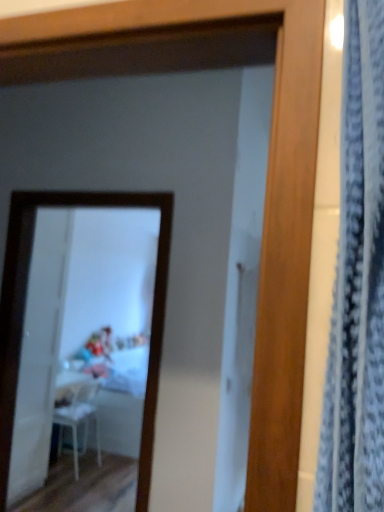
What are the coordinates of `transparent plastic screen door at left` in the screenshot? It's located at (40, 351).

Locate an element on the screen. The width and height of the screenshot is (384, 512). blue textured curtain at right is located at coordinates (357, 282).

Measure the distance between white glossy mirror at upper center and camera.

A distance of 2.93 meters exists between white glossy mirror at upper center and camera.

In order to face white glossy mirror at upper center, should I rotate leftwards or rightwards?

To face it directly, rotate left by 16.118 degrees.

The height and width of the screenshot is (512, 384). What do you see at coordinates (78, 411) in the screenshot?
I see `white plastic chair at lower left` at bounding box center [78, 411].

Where is `white glossy table at center`? The height and width of the screenshot is (512, 384). white glossy table at center is located at coordinates (125, 383).

You are a GUI agent. You are given a task and a screenshot of the screen. Output one action in this format:
    pyautogui.click(x=<x>, y=<y>)
    Task: Click on the transparent plastic screen door at left
    
    Given the screenshot: What is the action you would take?
    pyautogui.click(x=40, y=351)

Could you tell me if blue textured curtain at right is turned towards white glossy mirror at upper center?

No, blue textured curtain at right is not aimed at white glossy mirror at upper center.

From a real-world perspective, is blue textured curtain at right physically located above or below white glossy mirror at upper center?

In terms of real-world spatial position, blue textured curtain at right is above white glossy mirror at upper center.

How different are the orientations of blue textured curtain at right and white glossy mirror at upper center in degrees?

They differ by 87.1 degrees in their facing directions.

In the scene shown: Is transparent plastic screen door at left to the right of white glossy table at center from the viewer's perspective?

No, transparent plastic screen door at left is not to the right of white glossy table at center.

Does transparent plastic screen door at left lie in front of white glossy table at center?

Yes, it is.

Identify the location of table below the transparent plastic screen door at left (from a real-world perspective). (x=125, y=383).

From a real-world perspective, is transparent plastic screen door at left located beneath white glossy mirror at upper center?

Yes.

Considering the sizes of objects transparent plastic screen door at left and white glossy mirror at upper center in the image provided, who is bigger, transparent plastic screen door at left or white glossy mirror at upper center?

white glossy mirror at upper center.

Is transparent plastic screen door at left wider than white glossy mirror at upper center?

No, transparent plastic screen door at left is not wider than white glossy mirror at upper center.

Is white glossy mirror at upper center smaller than transparent plastic screen door at left?

No.

Which is more to the right, white glossy mirror at upper center or transparent plastic screen door at left?

Positioned to the right is white glossy mirror at upper center.

Which is behind, white glossy mirror at upper center or transparent plastic screen door at left?

transparent plastic screen door at left is further away from the camera.

Do you think white glossy mirror at upper center is within transparent plastic screen door at left, or outside of it?

white glossy mirror at upper center is spatially situated outside transparent plastic screen door at left.

Locate an element on the screen. curtain on the right of white plastic chair at lower left is located at coordinates (357, 282).

From a real-world perspective, is blue textured curtain at right positioned above or below white plastic chair at lower left?

blue textured curtain at right is above white plastic chair at lower left.

Based on their sizes in the image, would you say blue textured curtain at right is bigger or smaller than white plastic chair at lower left?

Considering their sizes, blue textured curtain at right takes up less space than white plastic chair at lower left.

Which is behind, transparent plastic screen door at left or white plastic chair at lower left?

Positioned behind is white plastic chair at lower left.

Is transparent plastic screen door at left not within white plastic chair at lower left?

Indeed, transparent plastic screen door at left is completely outside white plastic chair at lower left.

Between transparent plastic screen door at left and white plastic chair at lower left, which one has more height?

With more height is transparent plastic screen door at left.

Considering the sizes of transparent plastic screen door at left and white plastic chair at lower left in the image, is transparent plastic screen door at left wider or thinner than white plastic chair at lower left?

Clearly, transparent plastic screen door at left has less width compared to white plastic chair at lower left.

Is point (89, 256) farther from viewer compared to point (335, 390)?

That is True.

From a real-world perspective, is white glossy mirror at upper center positioned under blue textured curtain at right based on gravity?

Yes, from a real-world perspective, white glossy mirror at upper center is beneath blue textured curtain at right.

Identify the location of curtain above the white glossy mirror at upper center (from a real-world perspective). Image resolution: width=384 pixels, height=512 pixels. (357, 282).

Which object is closer to the camera, white glossy mirror at upper center or blue textured curtain at right?

blue textured curtain at right is closer to the camera.

Identify the location of mirror that appears below the blue textured curtain at right (from a real-world perspective). The width and height of the screenshot is (384, 512). (85, 347).

Find the location of a particular element. The image size is (384, 512). screen door that appears above the white glossy table at center (from the image's perspective) is located at coordinates [x=40, y=351].

Considering their positions, is white glossy table at center positioned further to white glossy mirror at upper center than blue textured curtain at right?

Among the two, blue textured curtain at right is located further to white glossy mirror at upper center.

Considering their positions, is white glossy table at center positioned further to white plastic chair at lower left than blue textured curtain at right?

Among the two, blue textured curtain at right is located further to white plastic chair at lower left.

Based on their spatial positions, is blue textured curtain at right or transparent plastic screen door at left closer to white plastic chair at lower left?

transparent plastic screen door at left.

Estimate the real-world distances between objects in this image. Which object is further from white plastic chair at lower left, transparent plastic screen door at left or blue textured curtain at right?

Based on the image, blue textured curtain at right appears to be further to white plastic chair at lower left.

From the image, which object appears to be nearer to white glossy table at center, white plastic chair at lower left or blue textured curtain at right?

white plastic chair at lower left is positioned closer to the anchor white glossy table at center.

From the picture: Considering their positions, is white glossy mirror at upper center positioned closer to white plastic chair at lower left than blue textured curtain at right?

Based on the image, white glossy mirror at upper center appears to be nearer to white plastic chair at lower left.

When comparing their distances from transparent plastic screen door at left, does white glossy table at center or blue textured curtain at right seem further?

blue textured curtain at right is positioned further to the anchor transparent plastic screen door at left.

When comparing their distances from white glossy mirror at upper center, does transparent plastic screen door at left or white glossy table at center seem further?

Among the two, transparent plastic screen door at left is located further to white glossy mirror at upper center.

You are a GUI agent. You are given a task and a screenshot of the screen. Output one action in this format:
    pyautogui.click(x=<x>, y=<y>)
    Task: Click on the screen door located between white glossy mirror at upper center and white plastic chair at lower left in the depth direction
    
    Given the screenshot: What is the action you would take?
    pyautogui.click(x=40, y=351)

Locate an element on the screen. chair located between blue textured curtain at right and white glossy table at center in the depth direction is located at coordinates (78, 411).

This screenshot has height=512, width=384. What are the coordinates of `mirror between blue textured curtain at right and white glossy table at center along the z-axis` in the screenshot? It's located at (85, 347).

Where is `chair between transparent plastic screen door at left and white glossy table at center along the z-axis`? The width and height of the screenshot is (384, 512). chair between transparent plastic screen door at left and white glossy table at center along the z-axis is located at coordinates (78, 411).